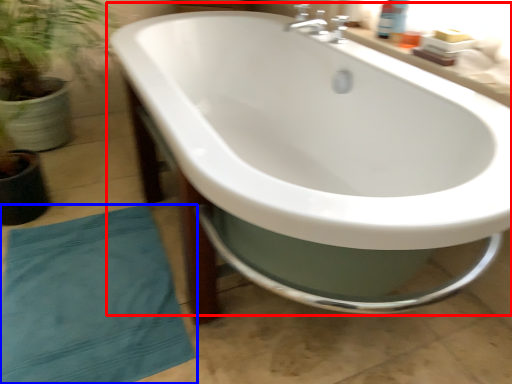
Question: Which object appears closest to the camera in this image, bathtub (highlighted by a red box) or beach towel (highlighted by a blue box)?

Choices:
 (A) bathtub
 (B) beach towel

Answer: (A)